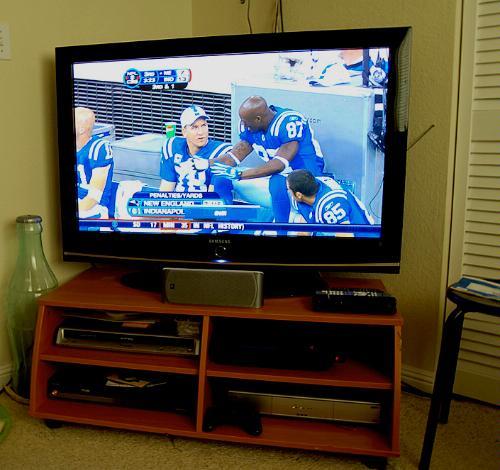
Image resolution: width=500 pixels, height=470 pixels. I want to click on remote control button, so click(x=341, y=291).